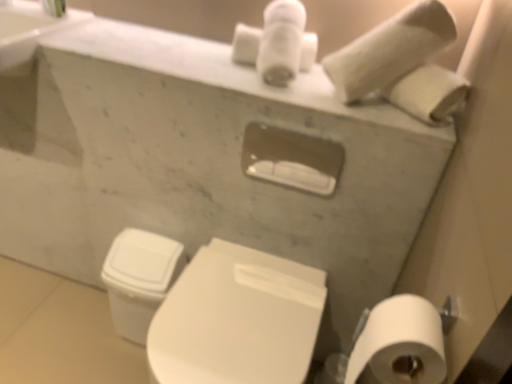
Question: Is white matte toilet paper at upper right, which is the 2th toilet paper from front to back, further to camera compared to white glossy toilet at lower center?

Choices:
 (A) no
 (B) yes

Answer: (B)

Question: Is white matte toilet paper at upper right, which ranks as the second toilet paper in bottom-to-top order, turned away from white glossy toilet at lower center?

Choices:
 (A) yes
 (B) no

Answer: (B)

Question: Considering the relative sizes of white matte toilet paper at upper right, marked as the first toilet paper in a top-to-bottom arrangement, and white glossy toilet at lower center in the image provided, is white matte toilet paper at upper right, marked as the first toilet paper in a top-to-bottom arrangement, shorter than white glossy toilet at lower center?

Choices:
 (A) no
 (B) yes

Answer: (B)

Question: Is the surface of white matte toilet paper at upper right, marked as the 1th toilet paper in a back-to-front arrangement, in direct contact with white glossy toilet at lower center?

Choices:
 (A) yes
 (B) no

Answer: (B)

Question: Is white glossy toilet at lower center inside white matte toilet paper at upper right, marked as the first toilet paper in a top-to-bottom arrangement?

Choices:
 (A) yes
 (B) no

Answer: (B)

Question: Relative to white matte toilet paper at lower right, positioned as the 2th toilet paper in top-to-bottom order, is white glossy toilet bowl at lower left in front or behind?

Choices:
 (A) behind
 (B) front

Answer: (A)

Question: Is white glossy toilet bowl at lower left taller or shorter than white matte toilet paper at lower right, positioned as the first toilet paper in front-to-back order?

Choices:
 (A) short
 (B) tall

Answer: (B)

Question: Choose the correct answer: Is white glossy toilet bowl at lower left inside white matte toilet paper at lower right, the 1th toilet paper positioned from the bottom, or outside it?

Choices:
 (A) outside
 (B) inside

Answer: (A)

Question: In the image, is white glossy toilet bowl at lower left on the left side or the right side of white matte toilet paper at lower right, the 1th toilet paper positioned from the bottom?

Choices:
 (A) left
 (B) right

Answer: (A)

Question: From a real-world perspective, is white matte toilet paper at lower right, positioned as the 2th toilet paper in back-to-front order, positioned above or below white glossy toilet at lower center?

Choices:
 (A) below
 (B) above

Answer: (B)

Question: From their relative heights in the image, would you say white matte toilet paper at lower right, positioned as the first toilet paper in front-to-back order, is taller or shorter than white glossy toilet at lower center?

Choices:
 (A) short
 (B) tall

Answer: (A)

Question: In the image, is white matte toilet paper at lower right, positioned as the first toilet paper in front-to-back order, positioned in front of or behind white glossy toilet at lower center?

Choices:
 (A) behind
 (B) front

Answer: (B)

Question: Is white matte toilet paper at lower right, positioned as the 2th toilet paper in top-to-bottom order, situated inside white glossy toilet at lower center or outside?

Choices:
 (A) outside
 (B) inside

Answer: (A)

Question: Is white matte toilet paper at lower right, positioned as the 2th toilet paper in top-to-bottom order, wider or thinner than white glossy toilet bowl at lower left?

Choices:
 (A) thin
 (B) wide

Answer: (A)

Question: Considering the positions of point (398, 302) and point (138, 273), is point (398, 302) closer or farther from the camera than point (138, 273)?

Choices:
 (A) farther
 (B) closer

Answer: (B)